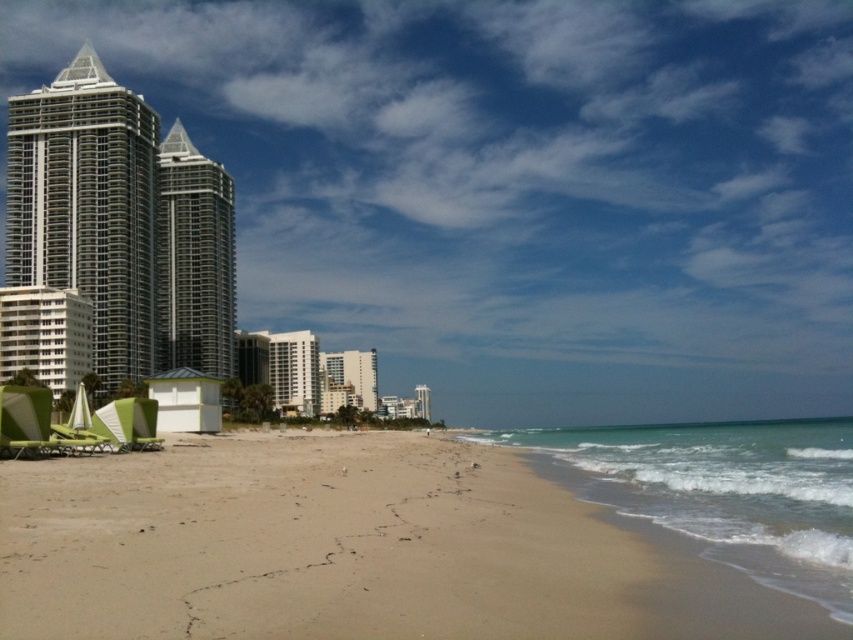
You are standing at the edge of the beach looking towards the ocean. There are two points marked on the sand. The first point is at coordinates point (181, 282) and the second is at point (332, 408). Which point is closer to you?

Point (181, 282) is closer to the camera than point (332, 408), so the first point is closer to you.

Consider the image. You are standing on the beach looking towards the ocean. You see the silver metallic building at upper left and the white glossy building at center. Which building is positioned to the left of the other?

The silver metallic building at upper left is to the left of the white glossy building at center.